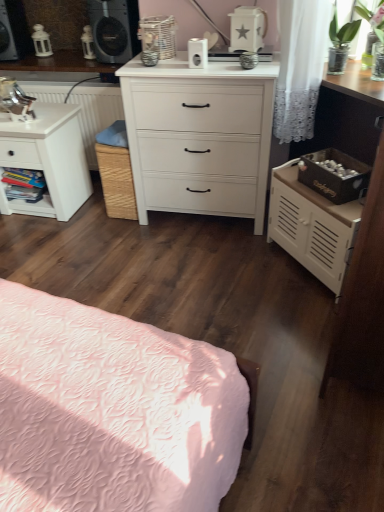
The width and height of the screenshot is (384, 512). In order to click on free space in front of white matte cabinet at right, placed as the second nightstand when sorted from left to right in this screenshot , I will do `click(291, 310)`.